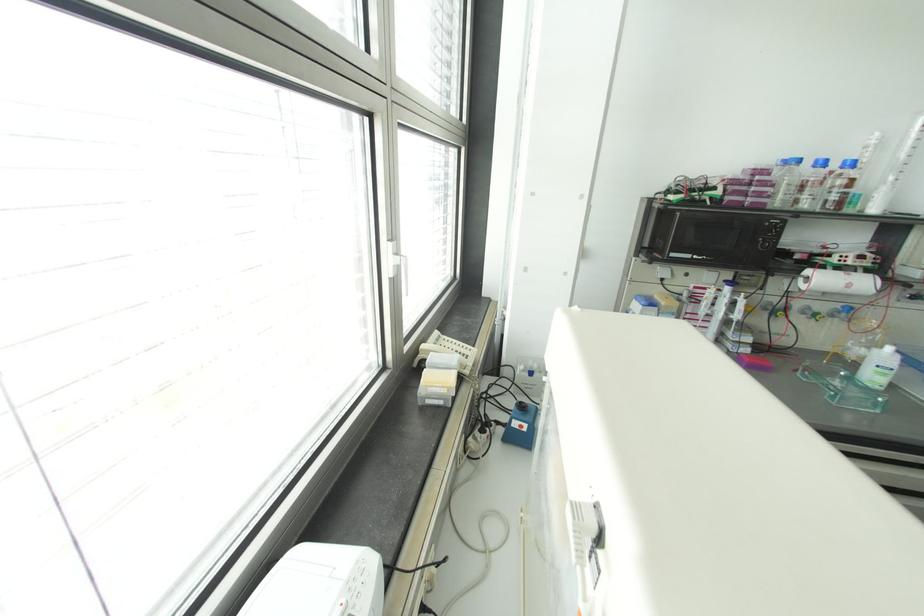
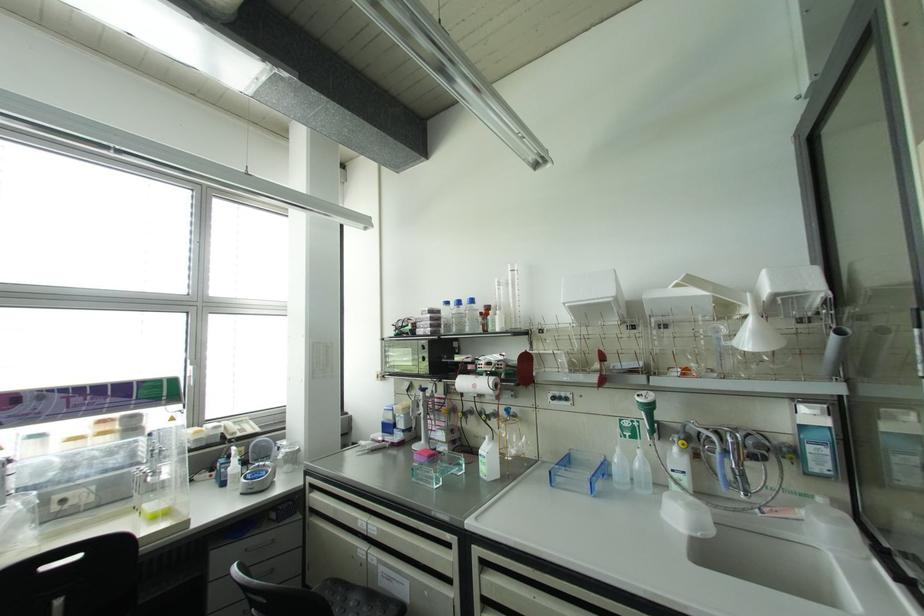
The point at (848, 285) is marked in the first image. Where is the corresponding point in the second image?

(473, 386)